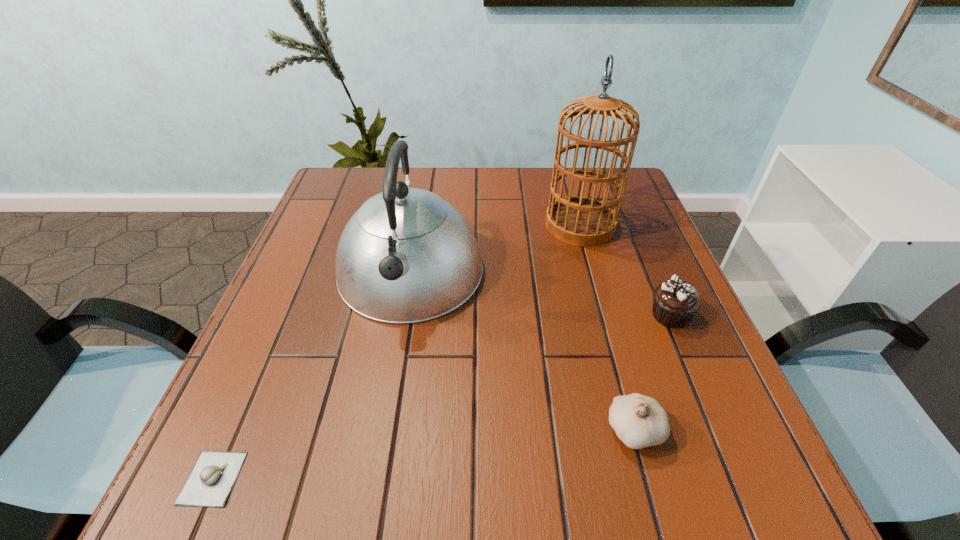
Find the location of a particular element. This screenshot has height=540, width=960. vacant space located on the left of the right garlic is located at coordinates (490, 430).

At what (x,y) coordinates should I click in order to perform the action: click on free space located 0.360m on the back of the leftmost object. Please return your answer as a coordinate pair (x, y). Looking at the image, I should click on (294, 291).

Identify the location of object that is positioned at the far edge. (579, 220).

This screenshot has width=960, height=540. I want to click on kettle that is positioned at the left edge, so click(x=406, y=255).

You are a GUI agent. You are given a task and a screenshot of the screen. Output one action in this format:
    pyautogui.click(x=<x>, y=<y>)
    Task: Click on the garlic that is positioned at the left edge
    The image size is (960, 540).
    Given the screenshot: What is the action you would take?
    pyautogui.click(x=210, y=482)

Where is `birdcage located in the right edge section of the desktop`? birdcage located in the right edge section of the desktop is located at coordinates tap(579, 220).

At what (x,y) coordinates should I click in order to perform the action: click on cupcake that is positioned at the right edge. Please return your answer as a coordinate pair (x, y). This screenshot has height=540, width=960. Looking at the image, I should click on (675, 302).

Where is `garlic situated at the right edge`? The height and width of the screenshot is (540, 960). garlic situated at the right edge is located at coordinates (639, 421).

The height and width of the screenshot is (540, 960). I want to click on object present at the near left corner, so click(x=210, y=482).

Locate an element on the screen. This screenshot has height=540, width=960. object that is at the far right corner is located at coordinates pos(579,220).